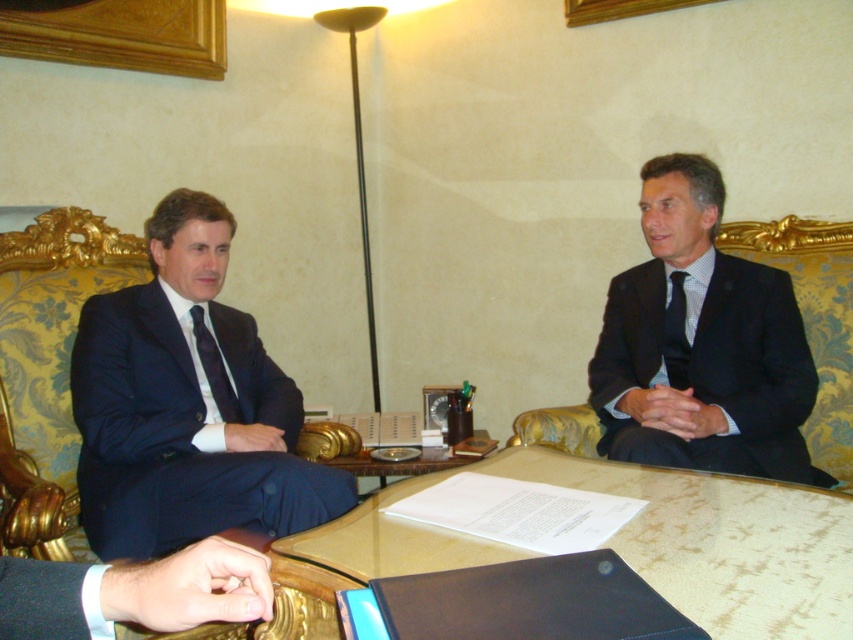
Question: Considering the relative positions of matte black suit at right and matte black tie at left in the image provided, where is matte black suit at right located with respect to matte black tie at left?

Choices:
 (A) right
 (B) left

Answer: (A)

Question: Is navy blue suit at left positioned at the back of matte black tie at left?

Choices:
 (A) yes
 (B) no

Answer: (B)

Question: Which point is farther to the camera?

Choices:
 (A) navy blue suit at left
 (B) matte black tie at right
 (C) matte black suit at right
 (D) glassy marble table at center

Answer: (B)

Question: Which object is closer to the camera taking this photo?

Choices:
 (A) matte black tie at left
 (B) matte black suit at right
 (C) navy blue suit at left
 (D) glassy marble table at center

Answer: (D)

Question: Considering the relative positions of matte black suit at right and matte black tie at left in the image provided, where is matte black suit at right located with respect to matte black tie at left?

Choices:
 (A) left
 (B) right

Answer: (B)

Question: Which point is closer to the camera?

Choices:
 (A) (747, 324)
 (B) (834, 595)

Answer: (B)